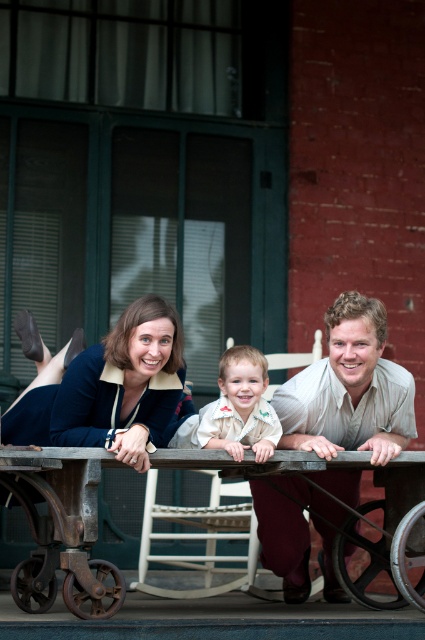
You are standing in front of the family scene. The rusty metal wagon at lower center and the matte blue blouse at center are both in your view. Which object is closer to you?

The rusty metal wagon at lower center is closer to you because it is in front of the matte blue blouse at center.

You are standing in front of the family scene. There are two points marked in the image. One is at coordinate point (47, 572) and the other at point (204, 422). Which point is closer to you?

Point (47, 572) is closer to the viewer than point (204, 422).

The image shows a family scene with a child between two adults. The child is leaning on a wooden cart and wearing a light shirt with a pattern. The adult on the left wears a navy blue outfit, and the adult on the right has a matte blue shirt at center. Which adult is closer to the wooden cart?

The adult on the left is closer to the wooden cart because the matte blue shirt at center is located at point (104, 384), which is further away compared to the left adult.